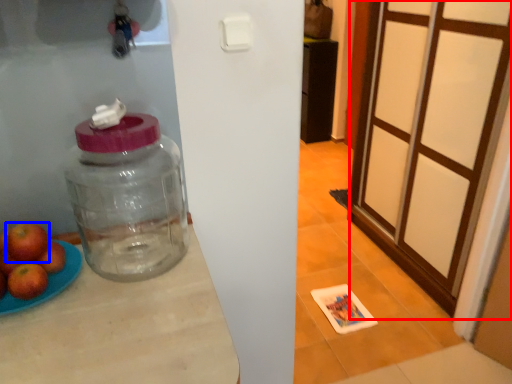
Question: Which object appears closest to the camera in this image, screen door (highlighted by a red box) or apple (highlighted by a blue box)?

Choices:
 (A) screen door
 (B) apple

Answer: (B)